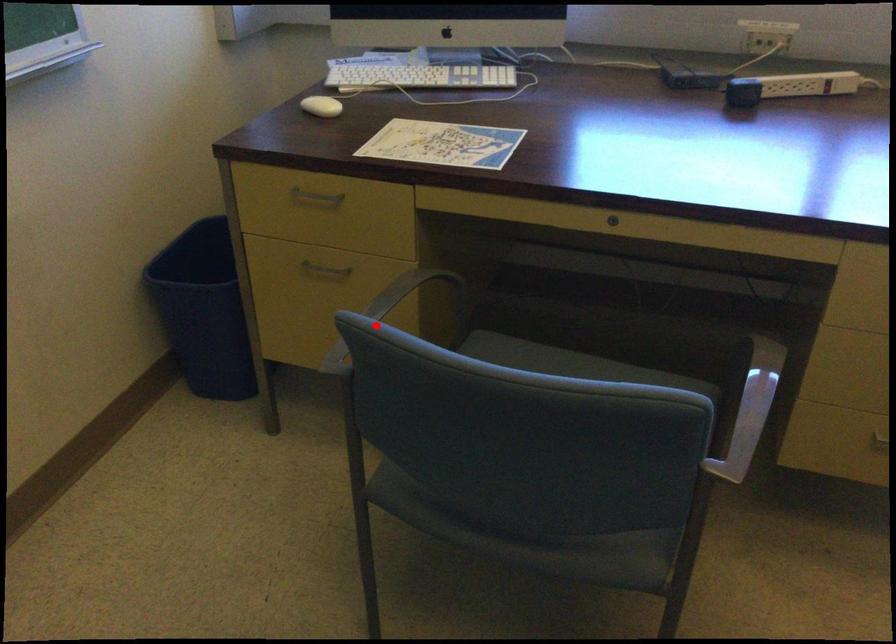
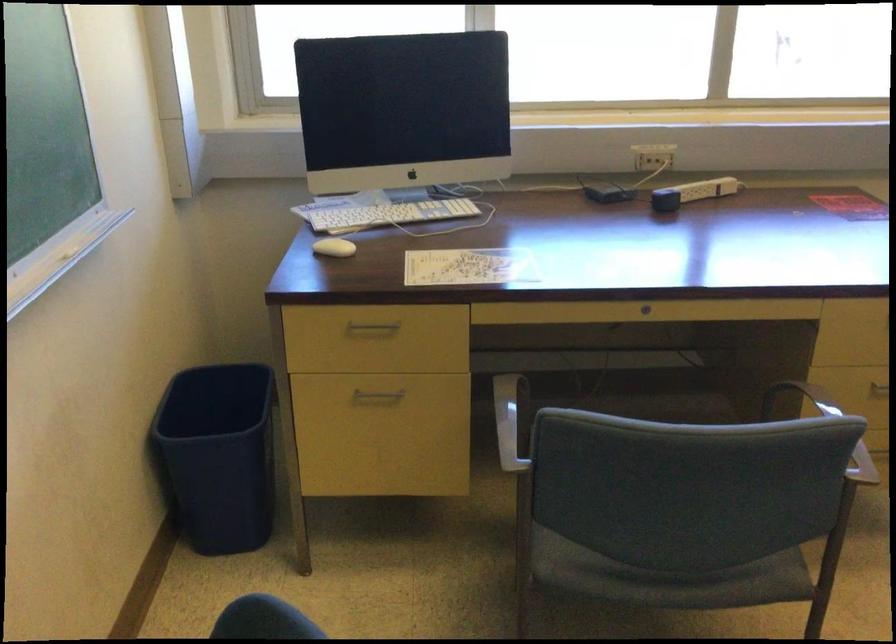
Question: I am providing you with two images of the same scene from different viewpoints. Image1 has a red point marked. In image2, the corresponding 3D location appears at what relative position? Reply with the corresponding letter.

Choices:
 (A) Closer
 (B) Farther

Answer: (B)